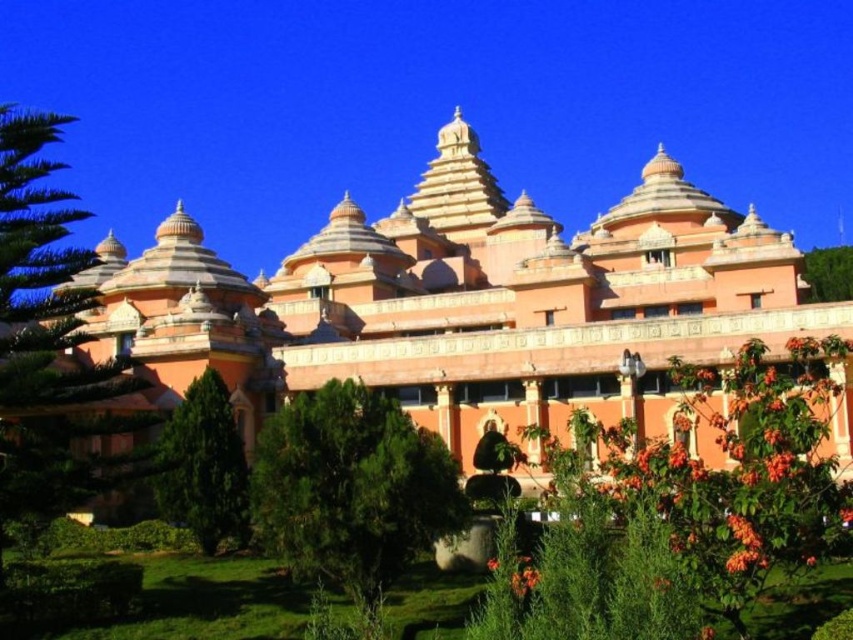
Question: Can you confirm if green leafy tree at lower left is thinner than green leafy tree at upper right?

Choices:
 (A) no
 (B) yes

Answer: (B)

Question: Does green leafy tree at left appear on the right side of green leafy tree at upper right?

Choices:
 (A) yes
 (B) no

Answer: (B)

Question: Which point appears closest to the camera in this image?

Choices:
 (A) (370, 468)
 (B) (196, 424)
 (C) (96, 296)

Answer: (A)

Question: Which object appears farthest from the camera in this image?

Choices:
 (A) orange matte building at center
 (B) green leafy tree at lower left
 (C) green leafy tree at upper right

Answer: (C)

Question: Is orange matte building at center below green leafy tree at left?

Choices:
 (A) yes
 (B) no

Answer: (A)

Question: Which object appears farthest from the camera in this image?

Choices:
 (A) green leafy tree at left
 (B) green leafy tree at lower left
 (C) green leafy tree at upper right

Answer: (C)